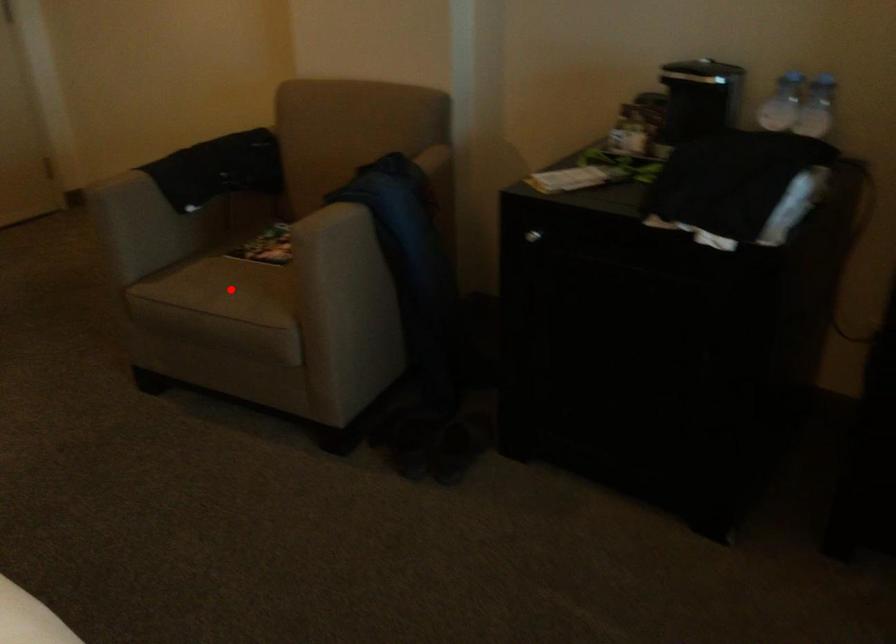
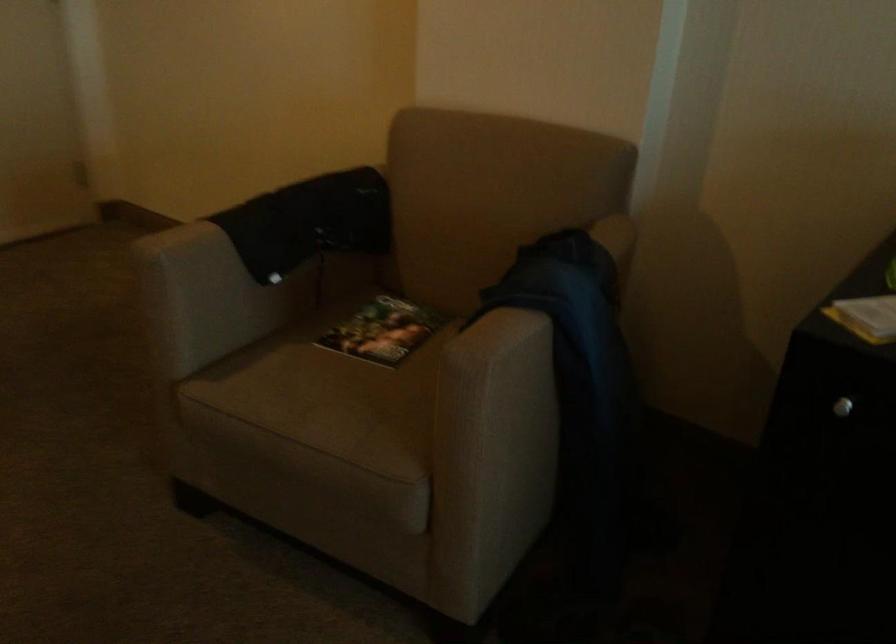
Locate, in the second image, the point that corresponds to the highlighted location in the first image.

(330, 404)